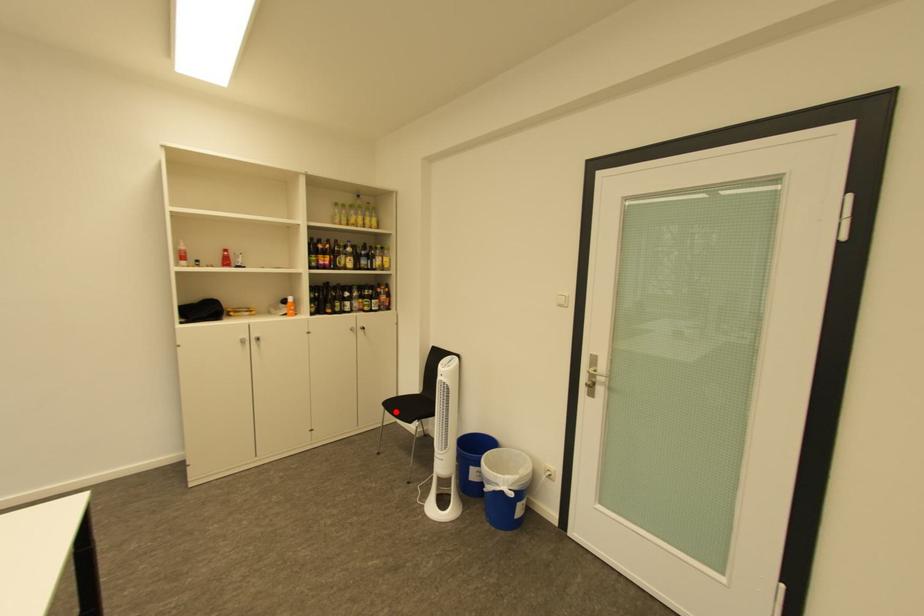
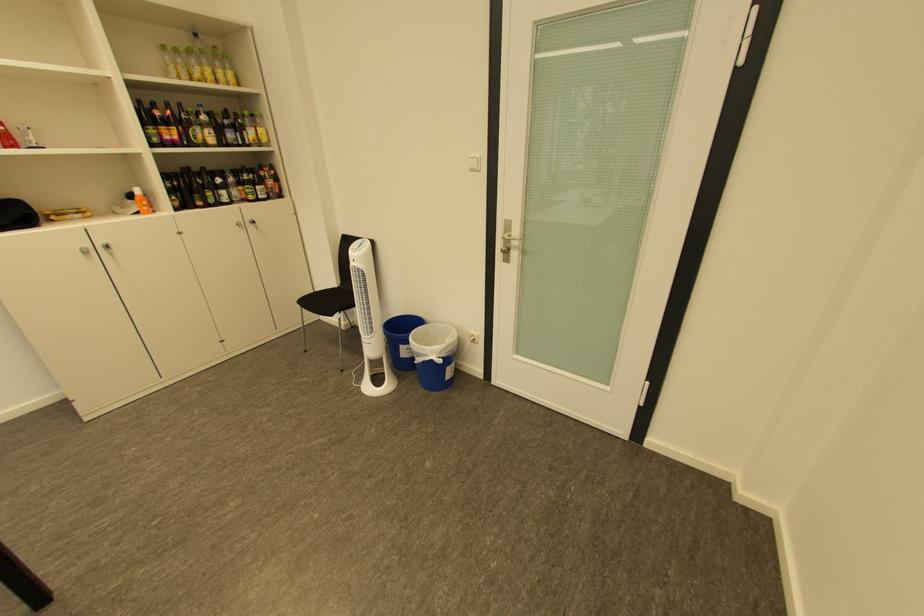
Question: I am providing you with two images of the same scene from different viewpoints. Image1 has a red point marked. In image2, the corresponding 3D location appears at what relative position? Reply with the corresponding letter.

Choices:
 (A) Closer
 (B) Farther

Answer: (B)